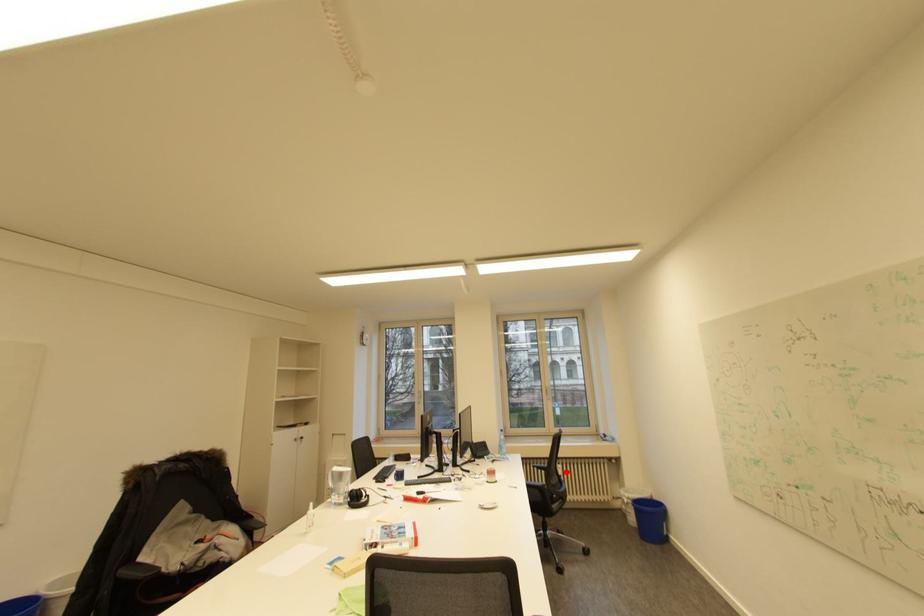
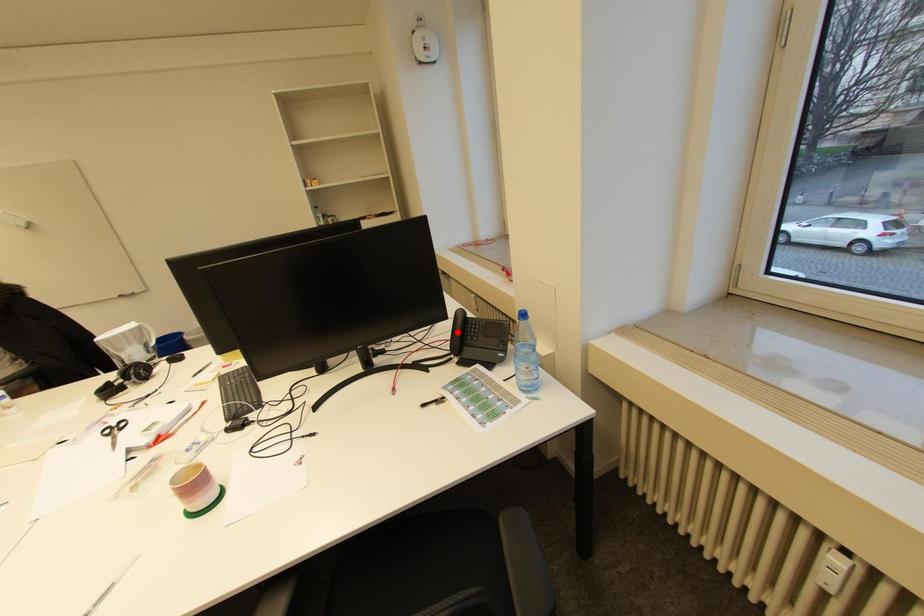
I am providing you with two images of the same scene from different viewpoints. A red point is marked on the first image and another point is marked on the second image. Are the points marked in image1 and image2 representing the same 3D position?

No